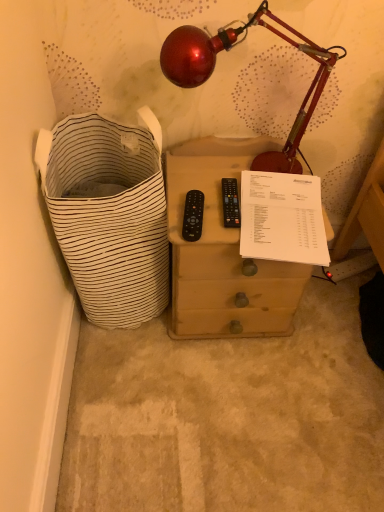
The height and width of the screenshot is (512, 384). In order to click on vacant area on the back side of black plastic remote at center, the second control when ordered from left to right in this screenshot , I will do `click(214, 173)`.